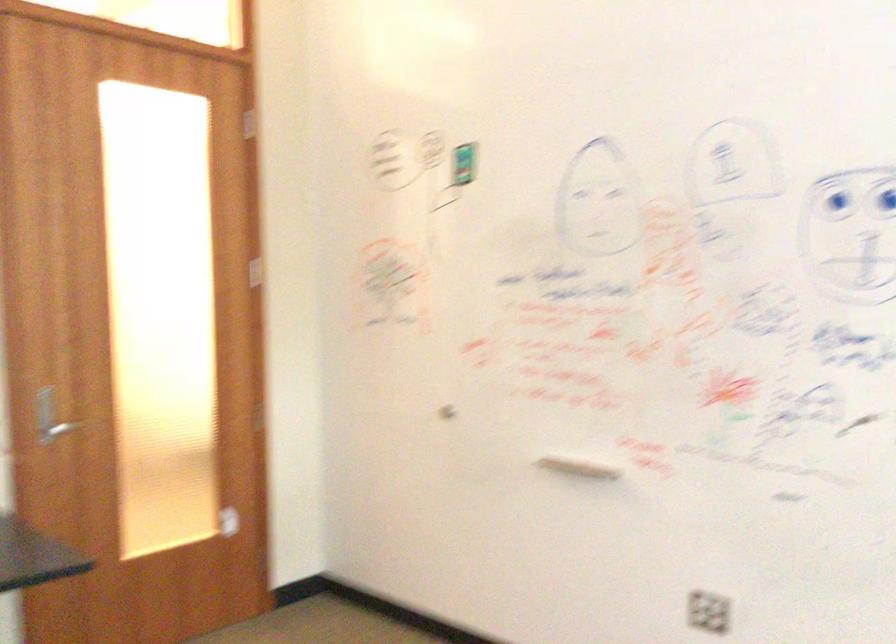
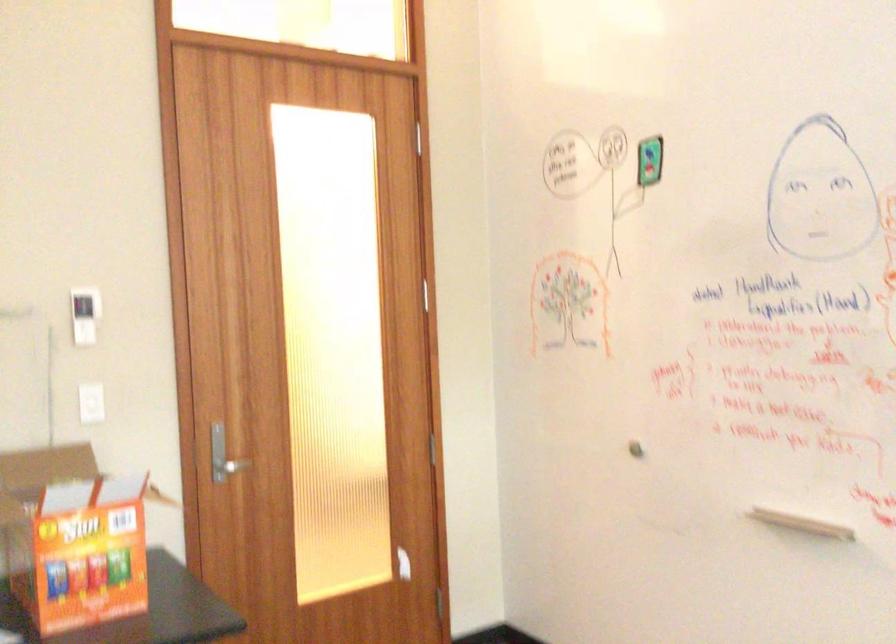
Locate, in the second image, the point that corresponds to (x=582, y=468) in the first image.

(800, 522)